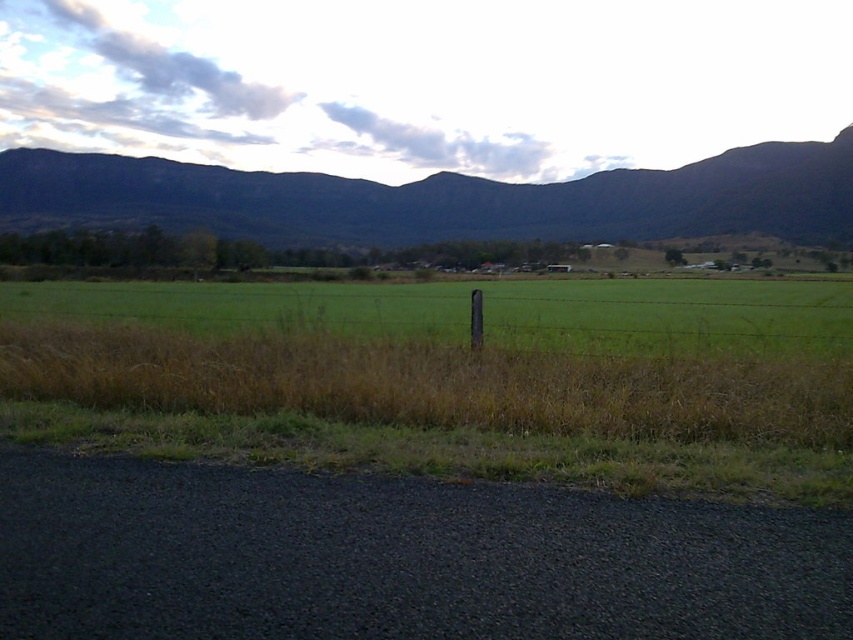
Between green grass at center and dark green forested mountain at upper center, which one appears on the left side from the viewer's perspective?

Positioned to the left is green grass at center.

Who is more forward, (486, 342) or (445, 221)?

Point (486, 342) is more forward.

Where is `green grass at center`? This screenshot has width=853, height=640. green grass at center is located at coordinates point(461,376).

Who is more forward, (24,292) or (769,342)?

Point (769,342) is more forward.

Between green grass at center and green grassy field at center, which one is positioned higher?

Positioned higher is green grassy field at center.

What do you see at coordinates (461, 376) in the screenshot? I see `green grass at center` at bounding box center [461, 376].

You are a GUI agent. You are given a task and a screenshot of the screen. Output one action in this format:
    pyautogui.click(x=<x>, y=<y>)
    Task: Click on the green grass at center
    
    Given the screenshot: What is the action you would take?
    pyautogui.click(x=461, y=376)

Which of these two, dark green forested mountain at upper center or green grassy field at center, stands taller?

With more height is dark green forested mountain at upper center.

Who is more forward, (x=473, y=209) or (x=305, y=301)?

Point (x=305, y=301)

Who is more forward, (405, 220) or (164, 324)?

Point (164, 324) is in front.

Locate an element on the screen. The image size is (853, 640). dark green forested mountain at upper center is located at coordinates point(440,198).